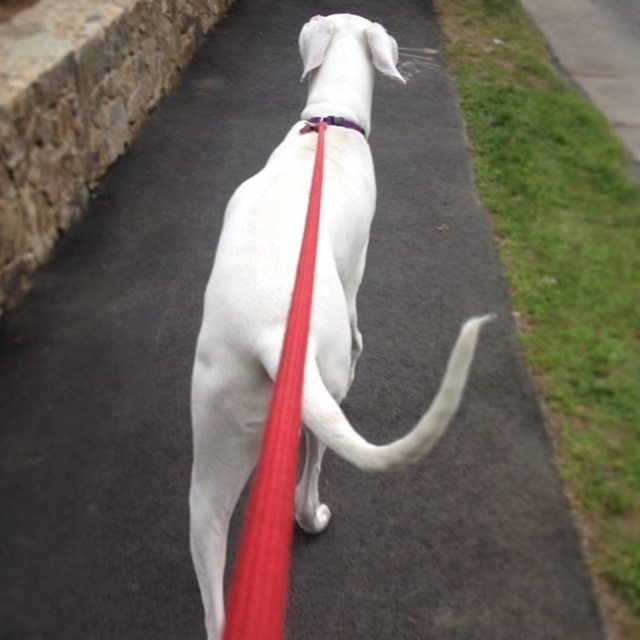
You are a dog owner trying to decide whether to let your dog off the leash while walking on the pathway. Considering the widths of the grassy sidewalk at right and the white smooth tail at center, which area is wider and safer for the dog to move around in?

The grassy sidewalk at right is wider than the white smooth tail at center, so it would be safer for the dog to move around there.

You are holding the red rubber leash at center and want to ensure the dog stays within the pathway. Based on the leash length, can the dog reach the grass on the right side of the pathway?

The red rubber leash at center is located at point (276, 460), so the dog can reach the grass on the right side of the pathway since the leash allows it to move freely in that direction.